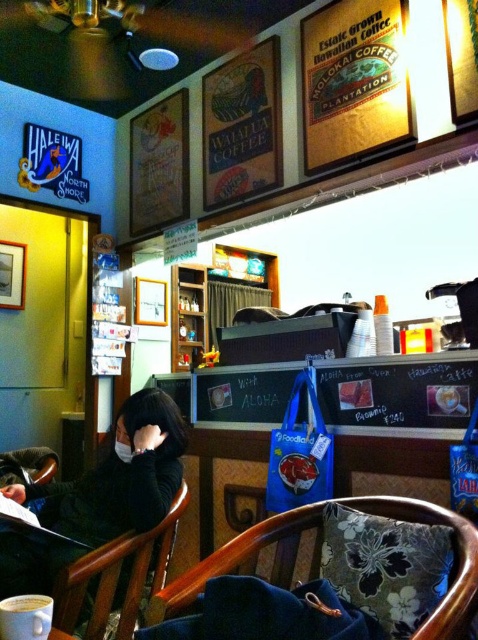
Is wooden chair at lower left smaller than white matte cup at center?

No, wooden chair at lower left is not smaller than white matte cup at center.

The image size is (478, 640). Find the location of `wooden chair at lower left`. wooden chair at lower left is located at coordinates (115, 577).

Is wooden chair at lower center thinner than white matte cup at center?

In fact, wooden chair at lower center might be wider than white matte cup at center.

Does wooden chair at lower center appear over white matte cup at center?

Actually, wooden chair at lower center is below white matte cup at center.

Image resolution: width=478 pixels, height=640 pixels. I want to click on wooden chair at lower center, so click(458, 560).

The height and width of the screenshot is (640, 478). Identify the location of wooden chair at lower center. (458, 560).

Is wooden chair at lower center below wooden chair at lower left?

Incorrect, wooden chair at lower center is not positioned below wooden chair at lower left.

Is point (444, 508) positioned in front of point (162, 541)?

Yes, point (444, 508) is closer to viewer.

Identify the location of wooden chair at lower center. (458, 560).

The image size is (478, 640). Identify the location of wooden chair at lower center. (458, 560).